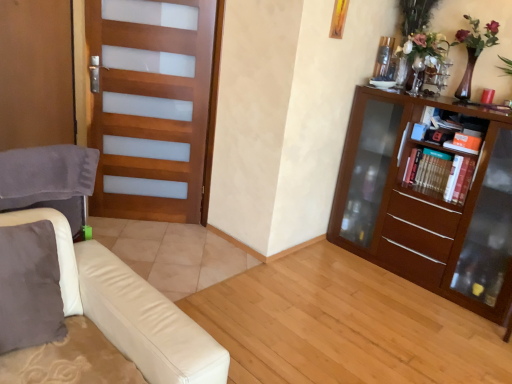
Question: Is velvet gray swivel chair at left oriented towards wooden screen door at left?

Choices:
 (A) yes
 (B) no

Answer: (A)

Question: From the image's perspective, does velvet gray swivel chair at left appear lower than wooden screen door at left?

Choices:
 (A) yes
 (B) no

Answer: (A)

Question: Can you confirm if velvet gray swivel chair at left is wider than wooden screen door at left?

Choices:
 (A) yes
 (B) no

Answer: (A)

Question: Does velvet gray swivel chair at left have a larger size compared to wooden screen door at left?

Choices:
 (A) yes
 (B) no

Answer: (B)

Question: Is velvet gray swivel chair at left smaller than wooden screen door at left?

Choices:
 (A) yes
 (B) no

Answer: (A)

Question: From a real-world perspective, is velvet gray swivel chair at left under wooden screen door at left?

Choices:
 (A) no
 (B) yes

Answer: (B)

Question: Does wooden bookshelf at right have a lesser height compared to hardcover books at right?

Choices:
 (A) no
 (B) yes

Answer: (B)

Question: Does wooden bookshelf at right appear on the right side of hardcover books at right?

Choices:
 (A) no
 (B) yes

Answer: (A)

Question: Can you confirm if wooden bookshelf at right is positioned to the left of hardcover books at right?

Choices:
 (A) no
 (B) yes

Answer: (B)

Question: Can you see wooden bookshelf at right touching hardcover books at right?

Choices:
 (A) yes
 (B) no

Answer: (A)

Question: From a real-world perspective, is wooden bookshelf at right located higher than hardcover books at right?

Choices:
 (A) no
 (B) yes

Answer: (A)

Question: Are wooden bookshelf at right and hardcover books at right far apart?

Choices:
 (A) no
 (B) yes

Answer: (A)

Question: From a real-world perspective, is wooden screen door at left on wooden bookshelf at right?

Choices:
 (A) yes
 (B) no

Answer: (A)